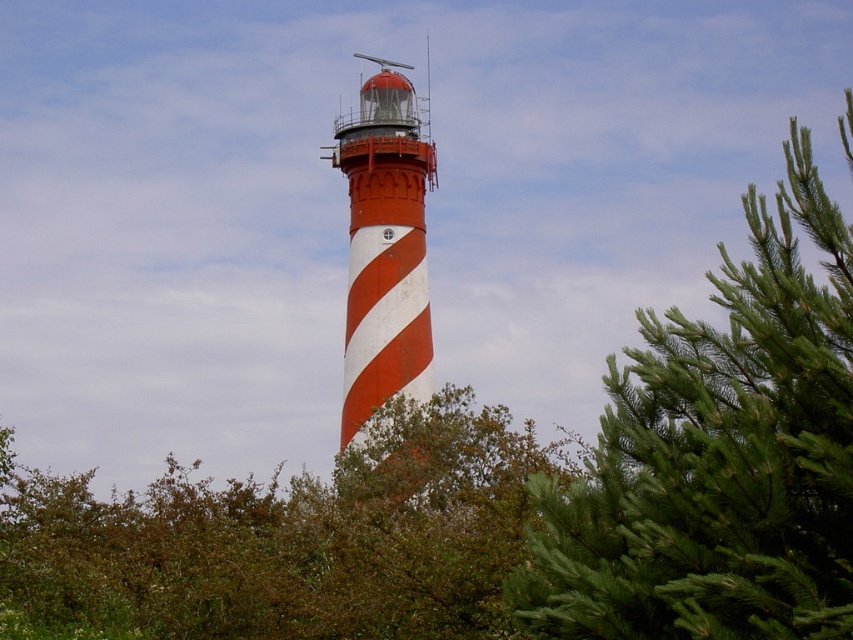
Question: Which of the following is the farthest from the observer?

Choices:
 (A) (747, 540)
 (B) (390, 144)

Answer: (B)

Question: Which object appears closest to the camera in this image?

Choices:
 (A) green needle-like at right
 (B) green leafy tree at center

Answer: (A)

Question: Can you confirm if green leafy tree at center is bigger than red and white striped lighthouse at center?

Choices:
 (A) no
 (B) yes

Answer: (B)

Question: Which point is farther to the camera?

Choices:
 (A) green needle-like at right
 (B) green leafy tree at center
 (C) red and white striped lighthouse at center

Answer: (C)

Question: Is green needle-like at right wider than green leafy tree at center?

Choices:
 (A) no
 (B) yes

Answer: (A)

Question: Is green leafy tree at center further to camera compared to red and white striped lighthouse at center?

Choices:
 (A) no
 (B) yes

Answer: (A)